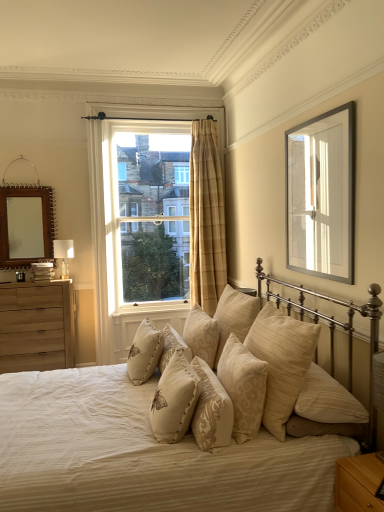
Where is `free point above wooden mirror at upper left (from a real-world perspective)`? Image resolution: width=384 pixels, height=512 pixels. free point above wooden mirror at upper left (from a real-world perspective) is located at coordinates (21, 155).